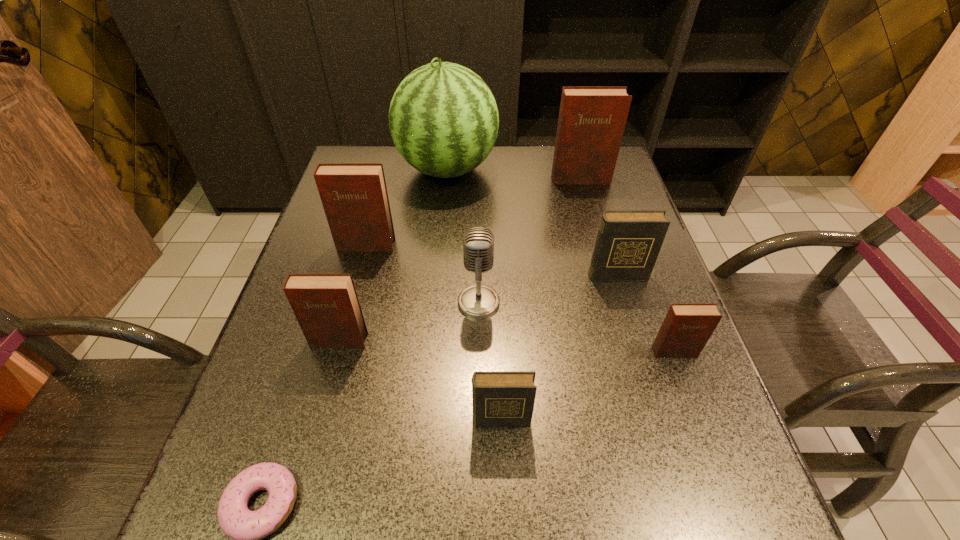
Locate an element on the screen. The width and height of the screenshot is (960, 540). vacant space situated 0.160m on the front cover of the second nearest object is located at coordinates (505, 526).

This screenshot has width=960, height=540. What are the coordinates of `vacant position located 0.100m on the front cover of the smallest reddish-brown diary` in the screenshot? It's located at (692, 403).

Identify the location of watermelon that is positioned at the far edge. (443, 118).

I want to click on diary located in the far edge section of the desktop, so click(592, 119).

Locate an element on the screen. The image size is (960, 540). object that is at the far right corner is located at coordinates (592, 119).

Identify the location of free space at the far edge of the desktop. The height and width of the screenshot is (540, 960). (535, 177).

In the image, there is a desktop. Identify the location of free region at the near edge. (309, 535).

I want to click on free space at the left edge of the desktop, so click(316, 231).

Locate an element on the screen. The width and height of the screenshot is (960, 540). free space at the right edge is located at coordinates (653, 294).

Where is `vacant area that lies between the farthest diary and the right dark diary`? The height and width of the screenshot is (540, 960). vacant area that lies between the farthest diary and the right dark diary is located at coordinates (599, 227).